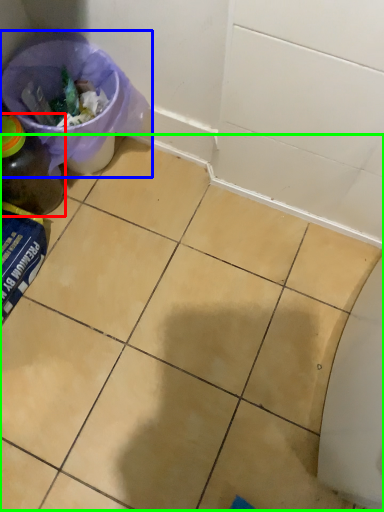
Question: Which object is the closest to the bottle (highlighted by a red box)? Choose among these: recycling bin (highlighted by a blue box) or ceramic tile (highlighted by a green box).

Choices:
 (A) recycling bin
 (B) ceramic tile

Answer: (A)